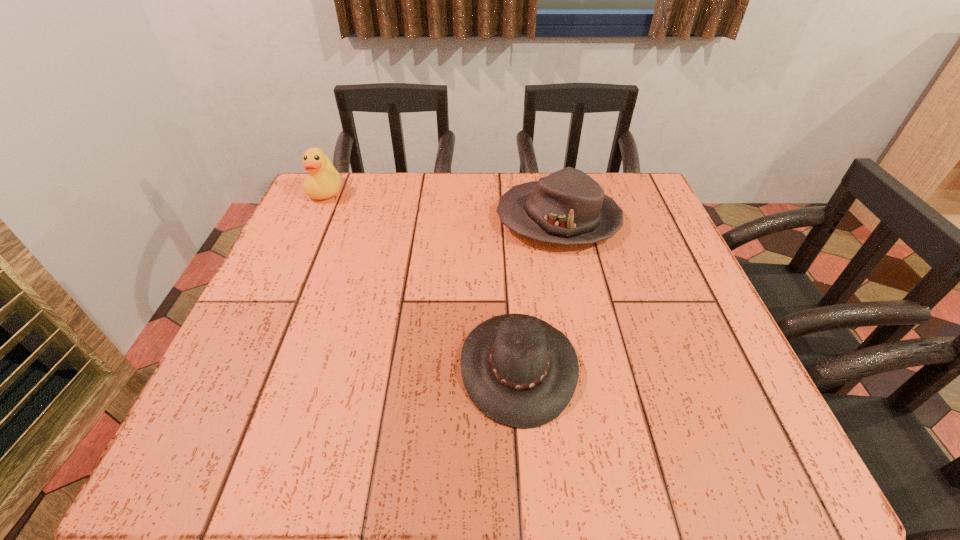
The height and width of the screenshot is (540, 960). Identify the location of free space that is in between the farther hat and the leftmost object. (443, 206).

You are a GUI agent. You are given a task and a screenshot of the screen. Output one action in this format:
    pyautogui.click(x=<x>, y=<y>)
    Task: Click on the vacant space in between the duck and the second tallest object
    
    Given the screenshot: What is the action you would take?
    pyautogui.click(x=443, y=206)

Find the location of a particular element. vacant area that lies between the shorter hat and the second shortest object is located at coordinates (539, 293).

I want to click on vacant point located between the nearest object and the farther hat, so click(x=539, y=293).

The height and width of the screenshot is (540, 960). I want to click on free space between the duck and the taller hat, so click(x=443, y=206).

Locate which object is the closest to the duck. Please provide its 2D coordinates. Your answer should be formatted as a tuple, i.e. [(x, y)], where the tuple contains the x and y coordinates of a point satisfying the conditions above.

[(568, 207)]

Identify which object is the second closest to the farther hat. Please provide its 2D coordinates. Your answer should be formatted as a tuple, i.e. [(x, y)], where the tuple contains the x and y coordinates of a point satisfying the conditions above.

[(323, 182)]